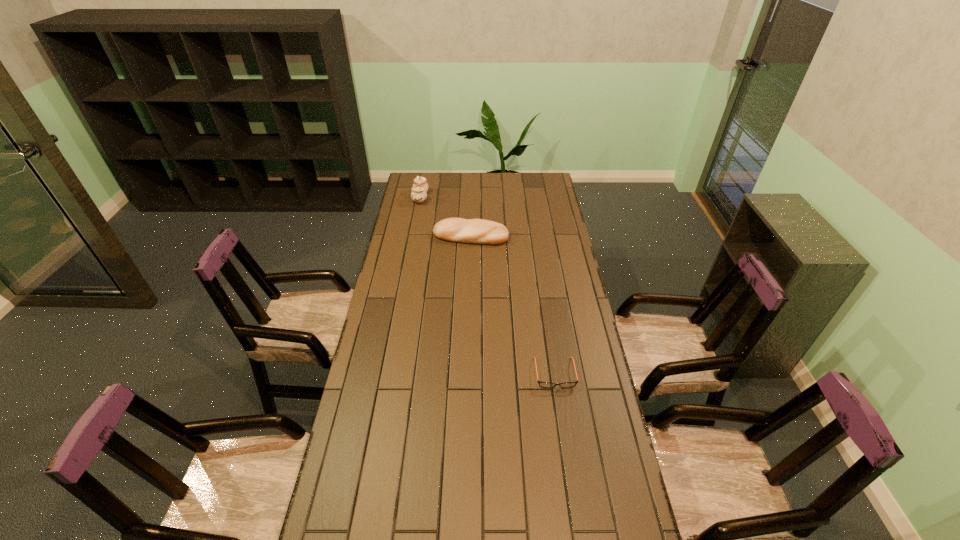
Find the location of `the tallest object`. the tallest object is located at coordinates (420, 186).

You are a GUI agent. You are given a task and a screenshot of the screen. Output one action in this format:
    pyautogui.click(x=<x>, y=<y>)
    Task: Click on the leftmost object
    This screenshot has width=960, height=540.
    Given the screenshot: What is the action you would take?
    pyautogui.click(x=420, y=186)

The height and width of the screenshot is (540, 960). I want to click on bread, so click(474, 231).

In order to click on the second nearest object in this screenshot , I will do `click(474, 231)`.

The image size is (960, 540). I want to click on the shortest object, so click(x=542, y=384).

The height and width of the screenshot is (540, 960). I want to click on the nearest object, so click(542, 384).

Find the location of `vacant area situated 0.150m by the handle of the tallest object`. vacant area situated 0.150m by the handle of the tallest object is located at coordinates (457, 198).

Identify the location of free point located 0.180m on the left of the second object from right to left. Image resolution: width=960 pixels, height=540 pixels. (395, 236).

The image size is (960, 540). I want to click on vacant space situated on the front-facing side of the shortest object, so click(x=563, y=423).

I want to click on object that is positioned at the far edge, so click(x=420, y=186).